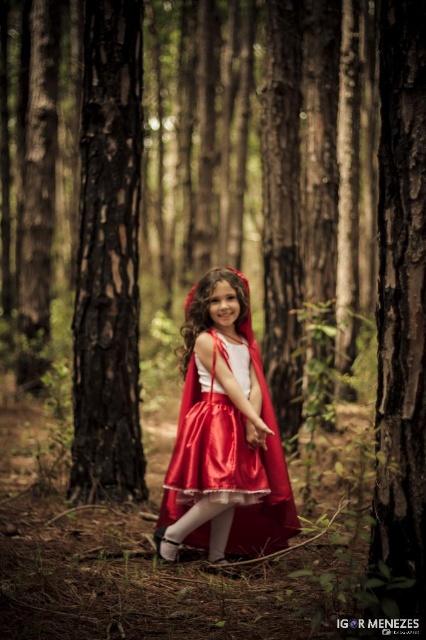
Question: Among these objects, which one is nearest to the camera?

Choices:
 (A) satin red cape at center
 (B) smooth bark tree at center

Answer: (B)

Question: Estimate the real-world distances between objects in this image. Which object is closer to the smooth dark brown bark at left?

Choices:
 (A) smooth bark tree at center
 (B) satin/red dress at center

Answer: (B)

Question: Does satin red cape at center come behind satin/red dress at center?

Choices:
 (A) yes
 (B) no

Answer: (A)

Question: Can you confirm if satin red cape at center is bigger than satin/red dress at center?

Choices:
 (A) no
 (B) yes

Answer: (B)

Question: Can you confirm if smooth dark brown bark at left is bigger than satin/red dress at center?

Choices:
 (A) yes
 (B) no

Answer: (A)

Question: Among these points, which one is nearest to the camera?

Choices:
 (A) (124, 378)
 (B) (275, 454)
 (C) (399, 33)

Answer: (C)